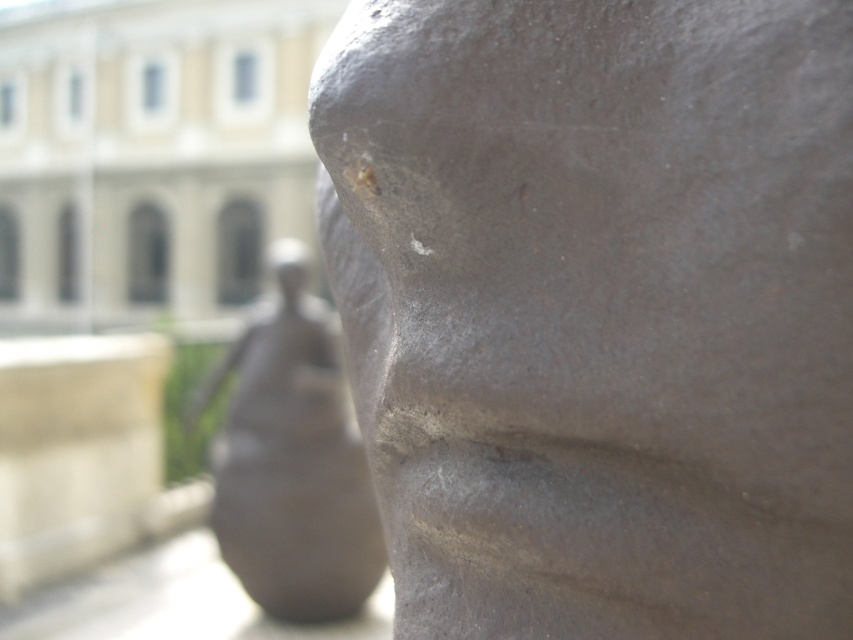
You are an art student analyzing the sculpture. You notice two elements, the matte gray stone face at center and the matte gray stone statue at center. Which one is positioned higher in the image?

The matte gray stone face at center is positioned higher than the matte gray stone statue at center in the image.

You are an architect analyzing the placement of the matte gray stone face at center in the sculpture. What are the coordinates of its position?

The coordinates of the matte gray stone face at center are at point (598, 308).

You are an art conservator assessing the sculpture. The matte gray stone face at center and the matte bronze head at center are part of the same installation. Which object has a smaller width?

The matte gray stone face at center has a lesser width compared to the matte bronze head at center.